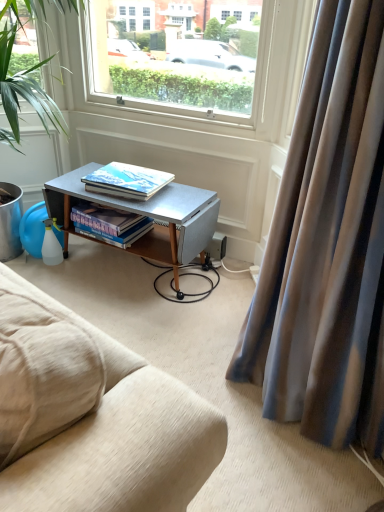
The height and width of the screenshot is (512, 384). I want to click on space that is in front of metallic gray desk at center, so click(140, 315).